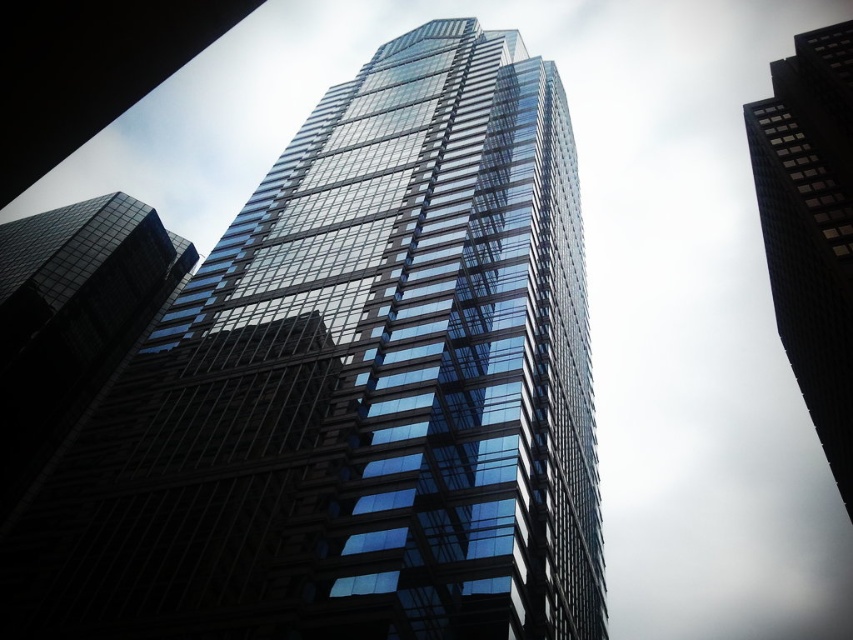
Question: Does transparent glass building at center have a greater width compared to black glass skyscraper at upper right?

Choices:
 (A) no
 (B) yes

Answer: (B)

Question: Is transparent glass building at center wider than black glass skyscraper at upper right?

Choices:
 (A) no
 (B) yes

Answer: (B)

Question: Which point is closer to the camera?

Choices:
 (A) black glass skyscraper at upper right
 (B) transparent glass building at center

Answer: (B)

Question: Is transparent glass building at center positioned behind black glass skyscraper at upper right?

Choices:
 (A) no
 (B) yes

Answer: (A)